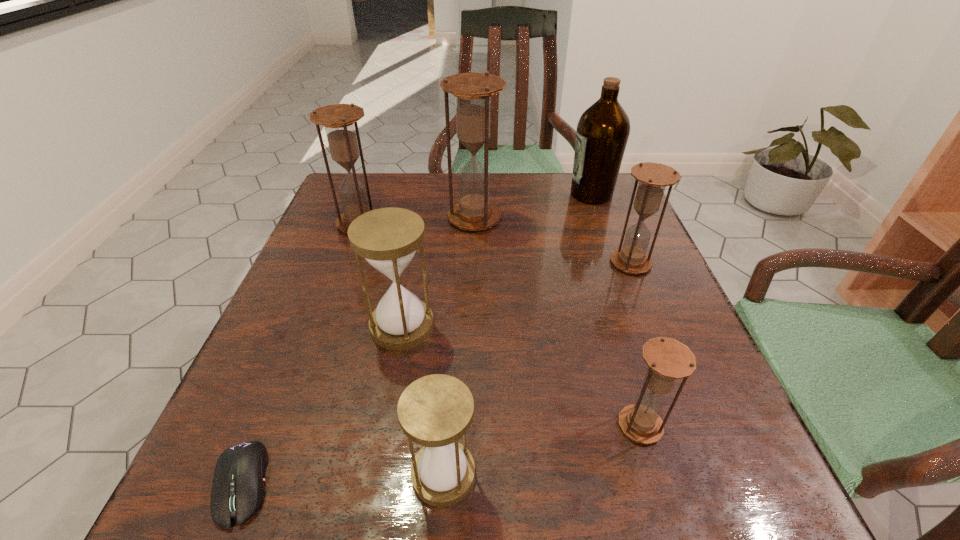
Identify the location of vacant space located on the back of the fourth nearest object. This screenshot has height=540, width=960. (418, 242).

You are a GUI agent. You are given a task and a screenshot of the screen. Output one action in this format:
    pyautogui.click(x=<x>, y=<y>)
    Task: Click on the free region located on the back of the second brown hourglass from right to left
    This screenshot has height=540, width=960.
    Given the screenshot: What is the action you would take?
    pyautogui.click(x=594, y=271)

What are the coordinates of `free space located on the back of the nearer white hourglass` in the screenshot? It's located at (455, 292).

The image size is (960, 540). In order to click on vacant area situated 0.060m on the right of the computer equipment in this screenshot , I will do `click(316, 483)`.

Locate an element on the screen. The width and height of the screenshot is (960, 540). olive oil situated at the far edge is located at coordinates (602, 133).

Where is `hourglass that is at the near edge`? This screenshot has width=960, height=540. hourglass that is at the near edge is located at coordinates [434, 411].

Find the location of a particular element. The width and height of the screenshot is (960, 540). computer equipment that is positioned at the near edge is located at coordinates (238, 490).

Image resolution: width=960 pixels, height=540 pixels. What are the coordinates of `hourglass situated at the left edge` in the screenshot? It's located at (339, 119).

The image size is (960, 540). Identify the location of computer equipment at the left edge. (238, 490).

The width and height of the screenshot is (960, 540). In order to click on olive oil at the right edge in this screenshot , I will do `click(602, 133)`.